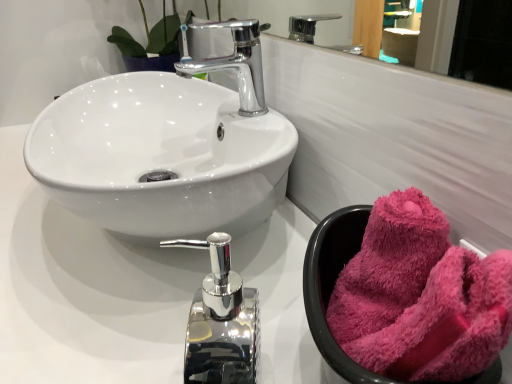
The image size is (512, 384). Describe the element at coordinates (236, 63) in the screenshot. I see `chrome/metallic faucet at upper center, marked as the first tap in a back-to-front arrangement` at that location.

The width and height of the screenshot is (512, 384). What do you see at coordinates (420, 297) in the screenshot?
I see `fuzzy pink towel at right` at bounding box center [420, 297].

This screenshot has height=384, width=512. Identify the location of polished chrome tap at center, which ranks as the 2th tap in back-to-front order. click(x=221, y=321).

Would you say fuzzy pink towel at right is inside or outside chrome/metallic faucet at upper center, which appears as the second tap when ordered from the bottom?

fuzzy pink towel at right cannot be found inside chrome/metallic faucet at upper center, which appears as the second tap when ordered from the bottom.

Does point (370, 359) come in front of point (259, 77)?

Yes, point (370, 359) is in front of point (259, 77).

Is the surface of fuzzy pink towel at right in direct contact with chrome/metallic faucet at upper center, the first tap positioned from the top?

No, fuzzy pink towel at right is not next to chrome/metallic faucet at upper center, the first tap positioned from the top.

You are a GUI agent. You are given a task and a screenshot of the screen. Output one action in this format:
    pyautogui.click(x=<x>, y=<y>)
    Task: Click on the towel/napkin below the chrome/metallic faucet at upper center, the first tap positioned from the top (from the image's perspective)
    This screenshot has height=384, width=512.
    Given the screenshot: What is the action you would take?
    pyautogui.click(x=420, y=297)

Is polished chrome tap at center, positioned as the 1th tap in bottom-to-top order, positioned in front of glossy chrome mirror at upper center?

Yes, polished chrome tap at center, positioned as the 1th tap in bottom-to-top order, is closer to the viewer.

Is polished chrome tap at center, which ranks as the 2th tap in back-to-front order, wider or thinner than glossy chrome mirror at upper center?

polished chrome tap at center, which ranks as the 2th tap in back-to-front order, is wider than glossy chrome mirror at upper center.

From a real-world perspective, is polished chrome tap at center, positioned as the 1th tap in bottom-to-top order, physically above glossy chrome mirror at upper center?

Actually, polished chrome tap at center, positioned as the 1th tap in bottom-to-top order, is physically below glossy chrome mirror at upper center in the real world.

Are polished chrome tap at center, which ranks as the 2th tap in top-to-bottom order, and glossy chrome mirror at upper center making contact?

polished chrome tap at center, which ranks as the 2th tap in top-to-bottom order, is not next to glossy chrome mirror at upper center, and they're not touching.

From a real-world perspective, is chrome/metallic faucet at upper center, marked as the first tap in a back-to-front arrangement, physically below polished chrome tap at center, positioned as the 1th tap in bottom-to-top order?

No.

In the scene shown: Is chrome/metallic faucet at upper center, which appears as the second tap when ordered from the bottom, inside or outside of polished chrome tap at center, which ranks as the 1th tap in front-to-back order?

chrome/metallic faucet at upper center, which appears as the second tap when ordered from the bottom, is spatially situated outside polished chrome tap at center, which ranks as the 1th tap in front-to-back order.

Is point (253, 64) closer to camera compared to point (222, 267)?

That is False.

The height and width of the screenshot is (384, 512). In order to click on mirror above the fuzzy pink towel at right (from a real-world perspective) in this screenshot , I will do `click(469, 41)`.

Does glossy chrome mirror at upper center contain fuzzy pink towel at right?

No, glossy chrome mirror at upper center does not contain fuzzy pink towel at right.

Who is more distant, glossy chrome mirror at upper center or fuzzy pink towel at right?

Positioned behind is glossy chrome mirror at upper center.

Between glossy chrome mirror at upper center and fuzzy pink towel at right, which one appears on the right side from the viewer's perspective?

From the viewer's perspective, fuzzy pink towel at right appears more on the right side.

Which is more to the right, chrome/metallic faucet at upper center, marked as the first tap in a back-to-front arrangement, or fuzzy pink towel at right?

From the viewer's perspective, fuzzy pink towel at right appears more on the right side.

How different are the orientations of chrome/metallic faucet at upper center, which appears as the second tap when ordered from the bottom, and fuzzy pink towel at right in degrees?

The facing directions of chrome/metallic faucet at upper center, which appears as the second tap when ordered from the bottom, and fuzzy pink towel at right are 57.9 degrees apart.

Is chrome/metallic faucet at upper center, which appears as the second tap when ordered from the bottom, taller than fuzzy pink towel at right?

Yes, chrome/metallic faucet at upper center, which appears as the second tap when ordered from the bottom, is taller than fuzzy pink towel at right.

Considering the points (247, 25) and (362, 251), which point is behind, point (247, 25) or point (362, 251)?

The point (247, 25) is farther from the camera.

Is point (486, 342) closer to viewer compared to point (219, 356)?

Yes, point (486, 342) is closer to viewer.

Which of these two, fuzzy pink towel at right or polished chrome tap at center, which ranks as the 2th tap in back-to-front order, is bigger?

Bigger between the two is polished chrome tap at center, which ranks as the 2th tap in back-to-front order.

Is fuzzy pink towel at right with polished chrome tap at center, which ranks as the 2th tap in back-to-front order?

No, fuzzy pink towel at right is not in contact with polished chrome tap at center, which ranks as the 2th tap in back-to-front order.

Can you confirm if fuzzy pink towel at right is thinner than polished chrome tap at center, which ranks as the 2th tap in back-to-front order?

Incorrect, the width of fuzzy pink towel at right is not less than that of polished chrome tap at center, which ranks as the 2th tap in back-to-front order.

Is point (206, 62) closer to camera compared to point (333, 3)?

Yes.

Are chrome/metallic faucet at upper center, the first tap positioned from the top, and glossy chrome mirror at upper center far apart?

Yes, chrome/metallic faucet at upper center, the first tap positioned from the top, and glossy chrome mirror at upper center are located far from each other.

From the image's perspective, which one is positioned lower, chrome/metallic faucet at upper center, which appears as the second tap when ordered from the bottom, or glossy chrome mirror at upper center?

From the image's view, chrome/metallic faucet at upper center, which appears as the second tap when ordered from the bottom, is below.

Looking at this image, considering the positions of objects chrome/metallic faucet at upper center, the first tap positioned from the top, and glossy chrome mirror at upper center in the image provided, who is more to the right, chrome/metallic faucet at upper center, the first tap positioned from the top, or glossy chrome mirror at upper center?

From the viewer's perspective, glossy chrome mirror at upper center appears more on the right side.

The height and width of the screenshot is (384, 512). I want to click on towel/napkin that is on the right side of chrome/metallic faucet at upper center, which appears as the second tap when ordered from the bottom, so click(420, 297).

You are a GUI agent. You are given a task and a screenshot of the screen. Output one action in this format:
    pyautogui.click(x=<x>, y=<y>)
    Task: Click on the mirror above the polished chrome tap at center, which ranks as the 2th tap in back-to-front order (from the image's perspective)
    This screenshot has width=512, height=384.
    Given the screenshot: What is the action you would take?
    pyautogui.click(x=469, y=41)

When comparing their distances from chrome/metallic faucet at upper center, the first tap positioned from the top, does polished chrome tap at center, which ranks as the 2th tap in top-to-bottom order, or glossy chrome mirror at upper center seem further?

glossy chrome mirror at upper center lies further to chrome/metallic faucet at upper center, the first tap positioned from the top, than the other object.

Based on their spatial positions, is fuzzy pink towel at right or polished chrome tap at center, which ranks as the 2th tap in top-to-bottom order, closer to glossy chrome mirror at upper center?

The object closer to glossy chrome mirror at upper center is polished chrome tap at center, which ranks as the 2th tap in top-to-bottom order.

Estimate the real-world distances between objects in this image. Which object is closer to glossy chrome mirror at upper center, fuzzy pink towel at right or chrome/metallic faucet at upper center, which appears as the second tap when ordered from the bottom?

chrome/metallic faucet at upper center, which appears as the second tap when ordered from the bottom, lies closer to glossy chrome mirror at upper center than the other object.

Which object lies further to the anchor point chrome/metallic faucet at upper center, which appears as the second tap when ordered from the bottom, glossy chrome mirror at upper center or fuzzy pink towel at right?

The object further to chrome/metallic faucet at upper center, which appears as the second tap when ordered from the bottom, is glossy chrome mirror at upper center.

Which object lies further to the anchor point glossy chrome mirror at upper center, chrome/metallic faucet at upper center, marked as the first tap in a back-to-front arrangement, or fuzzy pink towel at right?

The object further to glossy chrome mirror at upper center is fuzzy pink towel at right.

Based on their spatial positions, is glossy chrome mirror at upper center or chrome/metallic faucet at upper center, marked as the 2th tap in a front-to-back arrangement, closer to polished chrome tap at center, which ranks as the 1th tap in front-to-back order?

chrome/metallic faucet at upper center, marked as the 2th tap in a front-to-back arrangement.

Based on their spatial positions, is chrome/metallic faucet at upper center, marked as the 2th tap in a front-to-back arrangement, or polished chrome tap at center, which ranks as the 2th tap in back-to-front order, further from glossy chrome mirror at upper center?

polished chrome tap at center, which ranks as the 2th tap in back-to-front order, is further to glossy chrome mirror at upper center.

Based on their spatial positions, is chrome/metallic faucet at upper center, the first tap positioned from the top, or fuzzy pink towel at right further from polished chrome tap at center, which ranks as the 2th tap in back-to-front order?

Based on the image, chrome/metallic faucet at upper center, the first tap positioned from the top, appears to be further to polished chrome tap at center, which ranks as the 2th tap in back-to-front order.

Where is `tap positioned between fuzzy pink towel at right and chrome/metallic faucet at upper center, marked as the 2th tap in a front-to-back arrangement, from near to far`? tap positioned between fuzzy pink towel at right and chrome/metallic faucet at upper center, marked as the 2th tap in a front-to-back arrangement, from near to far is located at coordinates (221, 321).

Locate an element on the screen. This screenshot has width=512, height=384. tap between glossy chrome mirror at upper center and polished chrome tap at center, which ranks as the 1th tap in front-to-back order, vertically is located at coordinates (236, 63).

Where is `towel/napkin between glossy chrome mirror at upper center and polished chrome tap at center, which ranks as the 2th tap in top-to-bottom order, from top to bottom`? This screenshot has height=384, width=512. towel/napkin between glossy chrome mirror at upper center and polished chrome tap at center, which ranks as the 2th tap in top-to-bottom order, from top to bottom is located at coordinates (420, 297).

Locate an element on the screen. The width and height of the screenshot is (512, 384). tap that lies between glossy chrome mirror at upper center and fuzzy pink towel at right from top to bottom is located at coordinates (236, 63).